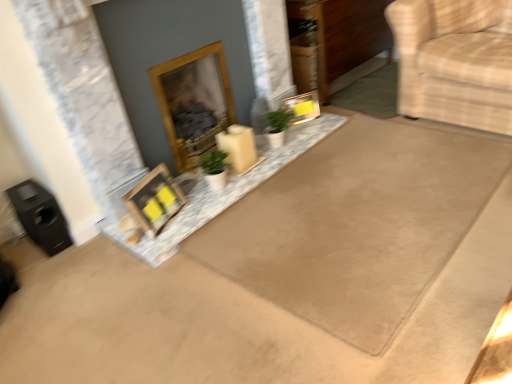
This screenshot has height=384, width=512. Identify the location of free point to the right of wooden picture frame at center, which is the 1th picture frame in bottom-to-top order. (192, 208).